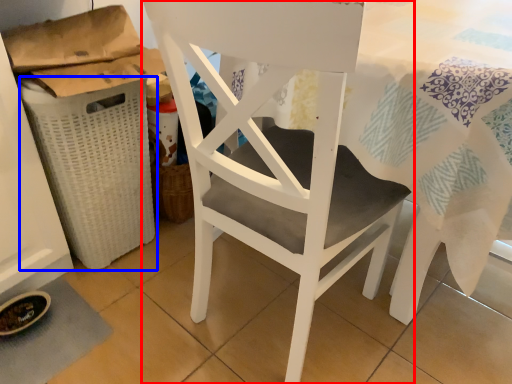
Question: Among these objects, which one is nearest to the camera, chair (highlighted by a red box) or laundry basket (highlighted by a blue box)?

Choices:
 (A) chair
 (B) laundry basket

Answer: (A)